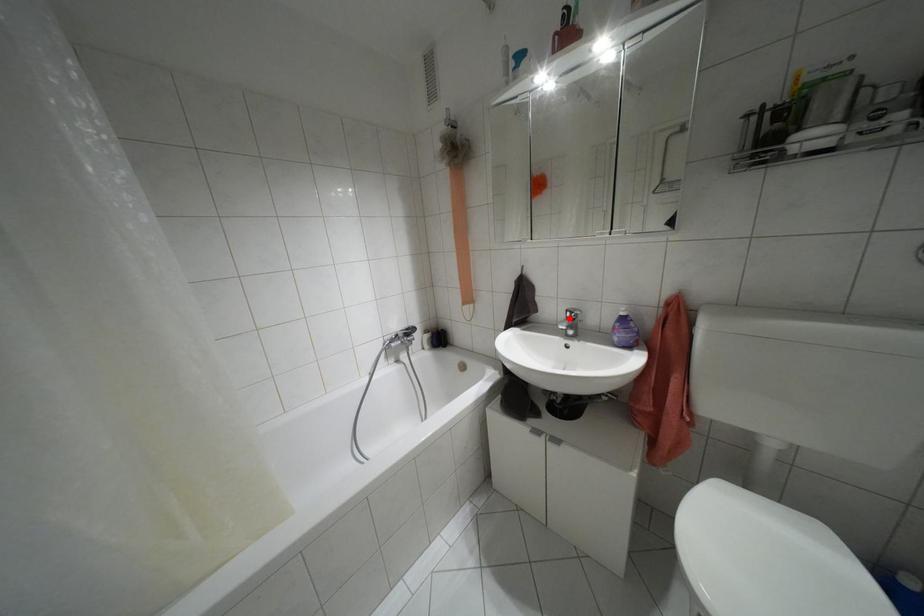
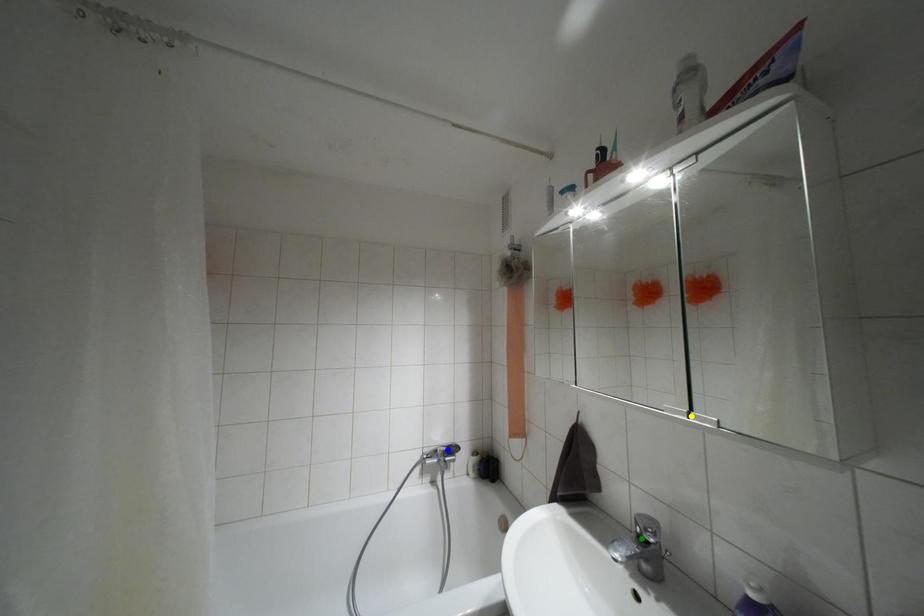
Question: I am providing you with two images of the same scene from different viewpoints. A red point is marked on the first image. You are given multiple points on the second image. Which spot in image 2 lines up with the point in image 1?

Choices:
 (A) blue point
 (B) yellow point
 (C) green point

Answer: (C)